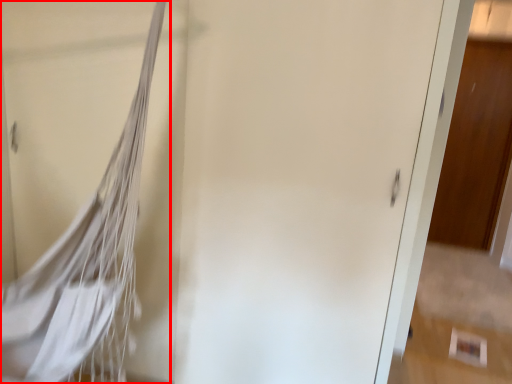
Question: From the image's perspective, what is the correct spatial positioning of tennis net (annotated by the red box) in reference to door?

Choices:
 (A) above
 (B) below

Answer: (B)